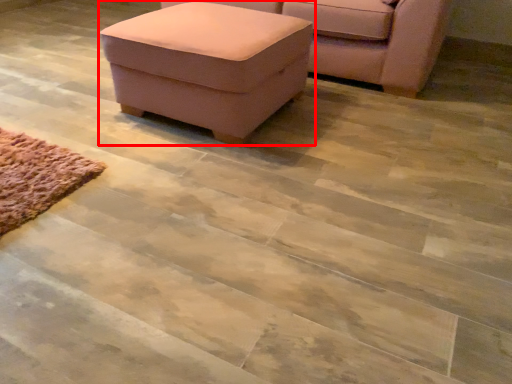
Question: From the image, what is the correct spatial relationship of table (annotated by the red box) in relation to chair?

Choices:
 (A) left
 (B) right

Answer: (A)